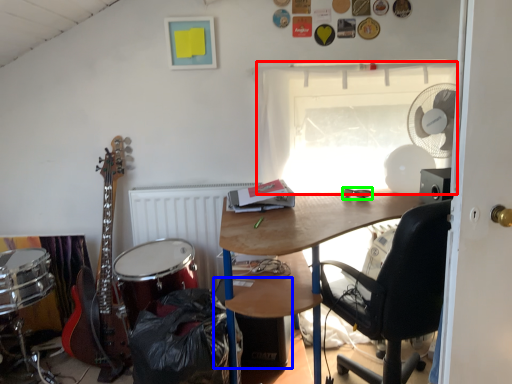
Question: Which is nearer to the window (highlighted by a red box)? loudspeaker (highlighted by a blue box) or glasses (highlighted by a green box).

Choices:
 (A) loudspeaker
 (B) glasses

Answer: (B)